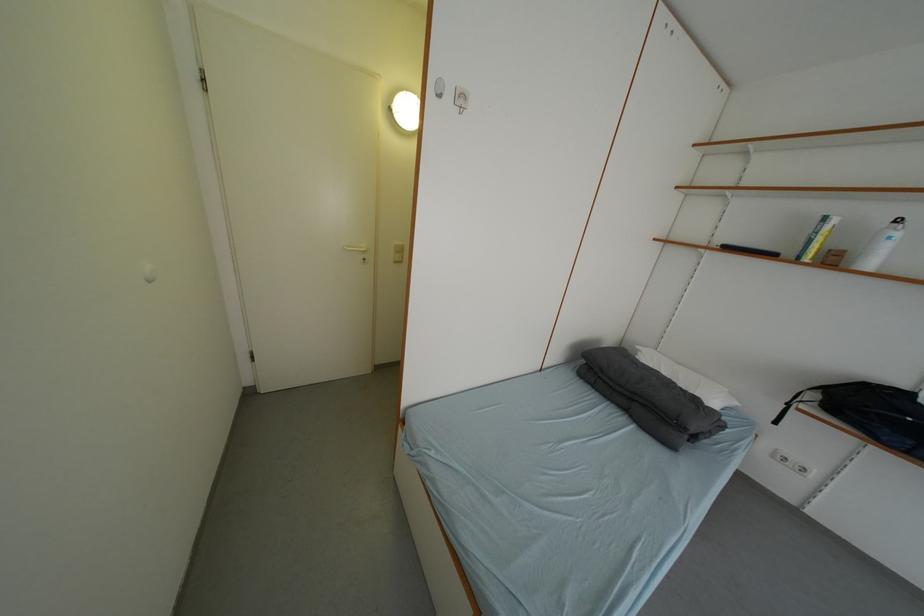
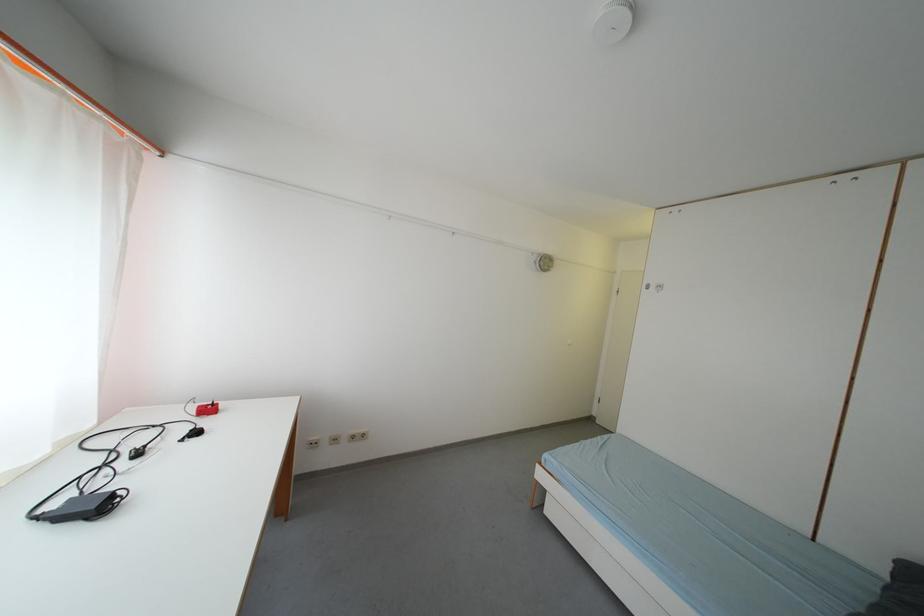
The point at (258, 397) is marked in the first image. Where is the corresponding point in the second image?

(600, 422)